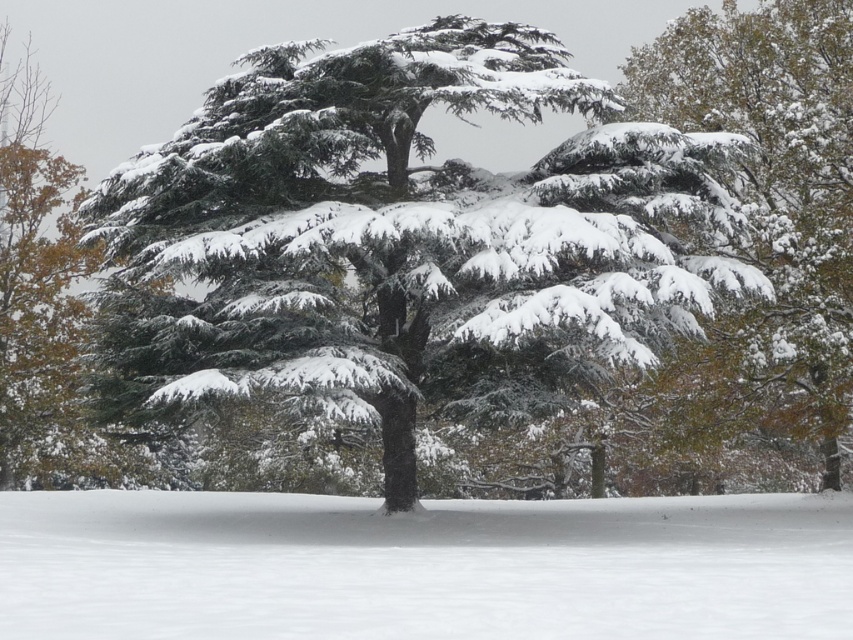
Question: Based on their relative distances, which object is farther from the snow-covered evergreen at upper right?

Choices:
 (A) green matte tree at left
 (B) white fluffy snow at center

Answer: (A)

Question: Is white fluffy snow at center in front of snow-covered evergreen at upper right?

Choices:
 (A) yes
 (B) no

Answer: (A)

Question: Can you confirm if green matte tree at center is positioned above green matte tree at left?

Choices:
 (A) yes
 (B) no

Answer: (B)

Question: Which is nearer to the green matte tree at center?

Choices:
 (A) green matte tree at left
 (B) white fluffy snow at center

Answer: (B)

Question: Which object is farther from the camera taking this photo?

Choices:
 (A) white fluffy snow at center
 (B) snow-covered evergreen at upper right
 (C) green matte tree at left

Answer: (B)

Question: Does green matte tree at center have a smaller size compared to white fluffy snow at center?

Choices:
 (A) no
 (B) yes

Answer: (A)